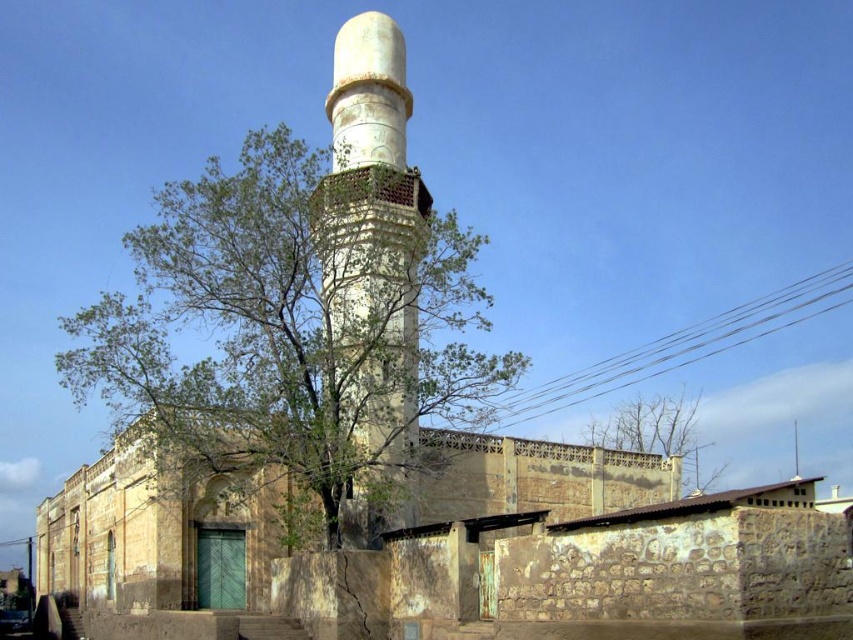
Question: Does white stone minaret at center appear on the left side of bare branches at upper center?

Choices:
 (A) yes
 (B) no

Answer: (A)

Question: Among these points, which one is farthest from the camera?

Choices:
 (A) (355, 257)
 (B) (590, 432)
 (C) (398, 438)

Answer: (B)

Question: Is green leafy tree at center above white stone minaret at center?

Choices:
 (A) yes
 (B) no

Answer: (B)

Question: Which object is the farthest from the bare branches at upper center?

Choices:
 (A) white stone minaret at center
 (B) green leafy tree at center

Answer: (A)

Question: Which is nearer to the white stone minaret at center?

Choices:
 (A) green leafy tree at center
 (B) bare branches at upper center

Answer: (A)

Question: Can you confirm if white stone minaret at center is smaller than bare branches at upper center?

Choices:
 (A) no
 (B) yes

Answer: (A)